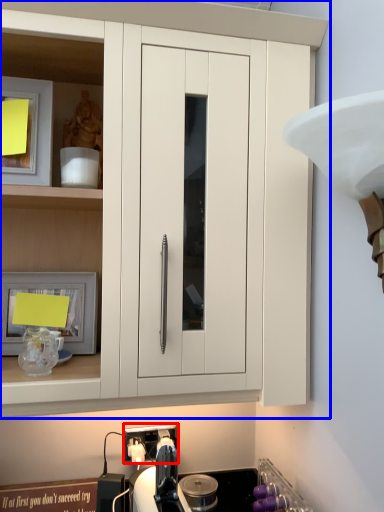
Question: Which object appears closest to the camera in this image, electric outlet (highlighted by a red box) or cabinetry (highlighted by a blue box)?

Choices:
 (A) electric outlet
 (B) cabinetry

Answer: (B)